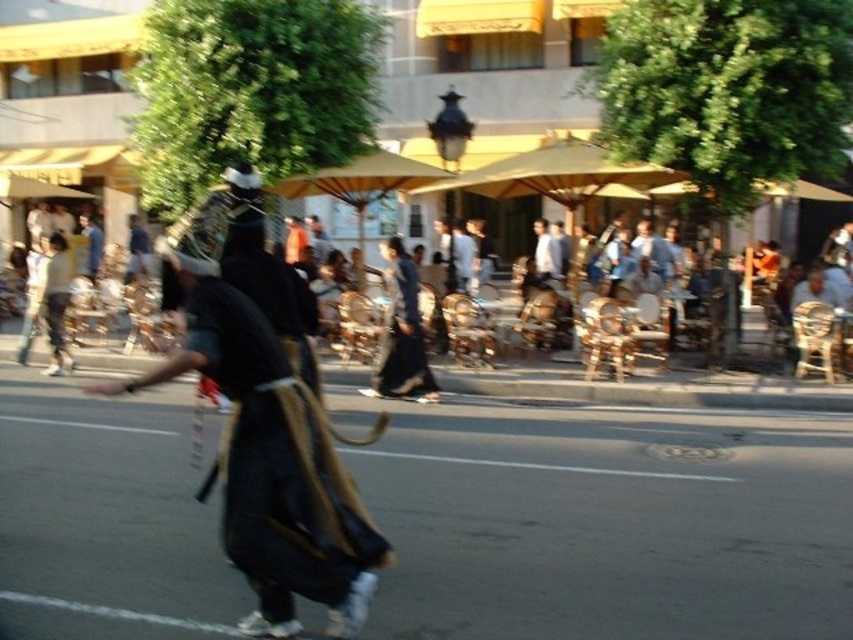
Question: Among these objects, which one is nearest to the camera?

Choices:
 (A) black fabric mask at center
 (B) dark blue fabric at center
 (C) dark blue fabric dress at center

Answer: (A)

Question: Does black fabric mask at center have a larger size compared to dark blue fabric dress at center?

Choices:
 (A) yes
 (B) no

Answer: (B)

Question: Considering the relative positions of dark blue fabric dress at center and dark blue fabric at center in the image provided, where is dark blue fabric dress at center located with respect to dark blue fabric at center?

Choices:
 (A) left
 (B) right

Answer: (A)

Question: Which of the following is the farthest from the observer?

Choices:
 (A) (405, 284)
 (B) (549, 276)

Answer: (B)

Question: Is dark blue fabric dress at center behind light blue fabric shirt at center?

Choices:
 (A) yes
 (B) no

Answer: (B)

Question: Which point appears farthest from the camera in this image?

Choices:
 (A) (347, 528)
 (B) (555, 273)
 (C) (405, 273)
 (D) (639, 234)

Answer: (B)